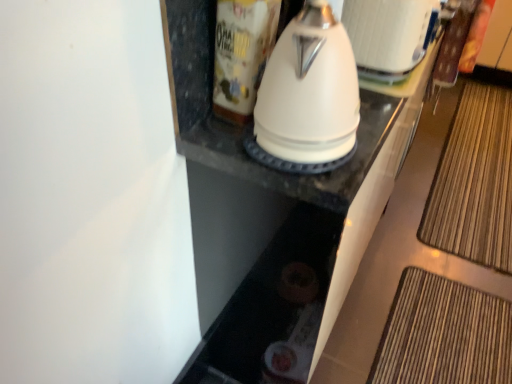
The image size is (512, 384). Describe the element at coordinates (307, 97) in the screenshot. I see `white glossy kettle at center` at that location.

What do you see at coordinates (390, 35) in the screenshot? Image resolution: width=512 pixels, height=384 pixels. I see `white glossy kettle at upper center` at bounding box center [390, 35].

This screenshot has width=512, height=384. I want to click on white glossy canister at upper center, so click(242, 54).

This screenshot has height=384, width=512. I want to click on appliance above the bamboo mat at lower right (from the image's perspective), so click(390, 35).

Is bamboo mat at lower right in contact with white glossy kettle at upper center?

There is a gap between bamboo mat at lower right and white glossy kettle at upper center.

Is point (472, 204) positioned after point (406, 60)?

That is True.

Does white glossy canister at upper center have a smaller size compared to bamboo mat at lower right?

Indeed, white glossy canister at upper center has a smaller size compared to bamboo mat at lower right.

Can you tell me how much white glossy canister at upper center and bamboo mat at lower right differ in facing direction?

The angle between the facing direction of white glossy canister at upper center and the facing direction of bamboo mat at lower right is 90.4 degrees.

In terms of width, does white glossy canister at upper center look wider or thinner when compared to bamboo mat at lower right?

In the image, white glossy canister at upper center appears to be more narrow than bamboo mat at lower right.

From a real-world perspective, is white glossy canister at upper center located higher than bamboo mat at lower right?

Yes, from a real-world perspective, white glossy canister at upper center is above bamboo mat at lower right.

From their relative heights in the image, would you say white glossy canister at upper center is taller or shorter than white glossy kettle at upper center?

white glossy canister at upper center is taller than white glossy kettle at upper center.

Locate an element on the screen. appliance directly beneath the white glossy canister at upper center (from a real-world perspective) is located at coordinates (390, 35).

Between white glossy canister at upper center and white glossy kettle at upper center, which one appears on the right side from the viewer's perspective?

From the viewer's perspective, white glossy kettle at upper center appears more on the right side.

Is white glossy kettle at upper center surrounded by white glossy canister at upper center?

Actually, white glossy kettle at upper center is outside white glossy canister at upper center.

Is white glossy kettle at center looking in the opposite direction of white glossy canister at upper center?

That's right, white glossy kettle at center is facing away from white glossy canister at upper center.

Identify the location of kitchen appliance below the white glossy canister at upper center (from a real-world perspective). (307, 97).

Is white glossy kettle at center beside white glossy canister at upper center?

No, white glossy kettle at center is not touching white glossy canister at upper center.

Based on the photo, visually, is white glossy kettle at center positioned to the left or to the right of white glossy canister at upper center?

Based on their positions, white glossy kettle at center is located to the right of white glossy canister at upper center.

Can you tell me how much white glossy kettle at upper center and white glossy canister at upper center differ in facing direction?

The facing directions of white glossy kettle at upper center and white glossy canister at upper center are 0.000312 degrees apart.

Considering the points (425, 39) and (251, 74), which point is in front, point (425, 39) or point (251, 74)?

The point (251, 74) is closer to the camera.

Is white glossy kettle at upper center facing away from white glossy canister at upper center?

No, white glossy kettle at upper center is not facing away from white glossy canister at upper center.

Which of these two, white glossy kettle at upper center or white glossy canister at upper center, stands shorter?

Standing shorter between the two is white glossy kettle at upper center.

From a real-world perspective, is white glossy kettle at center physically located above or below white glossy kettle at upper center?

From a real-world perspective, white glossy kettle at center is physically above white glossy kettle at upper center.

Considering the sizes of objects white glossy kettle at center and white glossy kettle at upper center in the image provided, who is smaller, white glossy kettle at center or white glossy kettle at upper center?

white glossy kettle at center is smaller.

From the image's perspective, is white glossy kettle at center on top of white glossy kettle at upper center?

No.

Is white glossy kettle at center facing towards white glossy kettle at upper center?

No, white glossy kettle at center is not aimed at white glossy kettle at upper center.

Considering the relative sizes of bamboo mat at lower right and white glossy canister at upper center in the image provided, is bamboo mat at lower right smaller than white glossy canister at upper center?

No, bamboo mat at lower right is not smaller than white glossy canister at upper center.

Is point (483, 216) positioned behind point (230, 63)?

Yes, point (483, 216) is behind point (230, 63).

From the picture: Which is correct: bamboo mat at lower right is inside white glossy canister at upper center, or outside of it?

The correct answer is: outside.

Can you confirm if bamboo mat at lower right is thinner than white glossy canister at upper center?

No, bamboo mat at lower right is not thinner than white glossy canister at upper center.

Where is `appliance on the left of bamboo mat at lower right`? This screenshot has height=384, width=512. appliance on the left of bamboo mat at lower right is located at coordinates (390, 35).

I want to click on beverage above the bamboo mat at lower right (from the image's perspective), so click(242, 54).

Looking at this image, looking at the image, which one is located closer to bamboo mat at lower right, white glossy canister at upper center or white glossy kettle at upper center?

white glossy kettle at upper center is positioned closer to the anchor bamboo mat at lower right.

Looking at the image, which one is located further to bamboo mat at lower right, white glossy kettle at center or white glossy canister at upper center?

Based on the image, white glossy canister at upper center appears to be further to bamboo mat at lower right.

Based on their spatial positions, is white glossy canister at upper center or white glossy kettle at upper center closer to white glossy kettle at center?

Among the two, white glossy canister at upper center is located nearer to white glossy kettle at center.

Based on their spatial positions, is white glossy canister at upper center or bamboo mat at lower right closer to white glossy kettle at upper center?

Based on the image, white glossy canister at upper center appears to be nearer to white glossy kettle at upper center.

Based on their spatial positions, is white glossy canister at upper center or white glossy kettle at center closer to bamboo mat at lower right?

white glossy kettle at center is positioned closer to the anchor bamboo mat at lower right.

From the image, which object appears to be farther from white glossy canister at upper center, bamboo mat at lower right or white glossy kettle at upper center?

bamboo mat at lower right.

Which object lies further to the anchor point bamboo mat at lower right, white glossy kettle at upper center or white glossy canister at upper center?

white glossy canister at upper center is positioned further to the anchor bamboo mat at lower right.

From the image, which object appears to be nearer to white glossy canister at upper center, white glossy kettle at center or bamboo mat at lower right?

Based on the image, white glossy kettle at center appears to be nearer to white glossy canister at upper center.

You are a GUI agent. You are given a task and a screenshot of the screen. Output one action in this format:
    pyautogui.click(x=<x>, y=<y>)
    Task: Click on the appliance between white glossy kettle at center and bamboo mat at lower right
    
    Given the screenshot: What is the action you would take?
    pyautogui.click(x=390, y=35)

The height and width of the screenshot is (384, 512). I want to click on kitchen appliance between white glossy canister at upper center and bamboo mat at lower right from left to right, so click(x=307, y=97).

Identify the location of appliance between white glossy canister at upper center and bamboo mat at lower right. (390, 35).

Locate an element on the screen. kitchen appliance situated between white glossy canister at upper center and white glossy kettle at upper center from left to right is located at coordinates (307, 97).